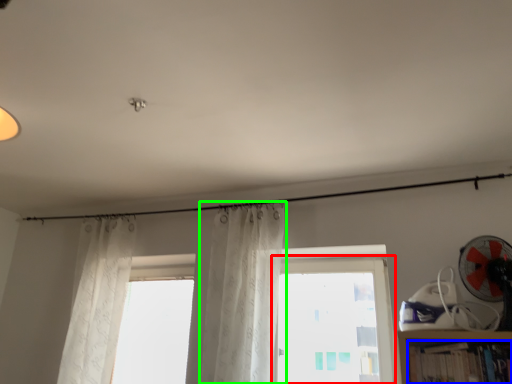
Question: Considering the real-world distances, which object is farthest from window (highlighted by a red box)? book (highlighted by a blue box) or curtain (highlighted by a green box)?

Choices:
 (A) book
 (B) curtain

Answer: (A)